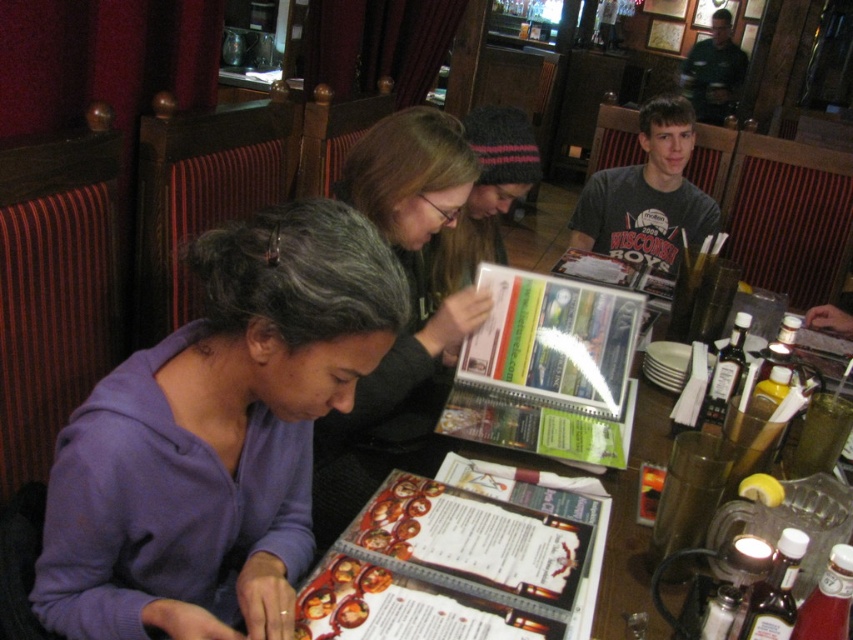
You are sitting at the table in the restaurant scene. There are two points marked on the table surface. One is at coordinate point (299,324) and the other is at point (473,184). Which of these two points is closer to you?

Point (299,324) is closer to you than point (473,184).